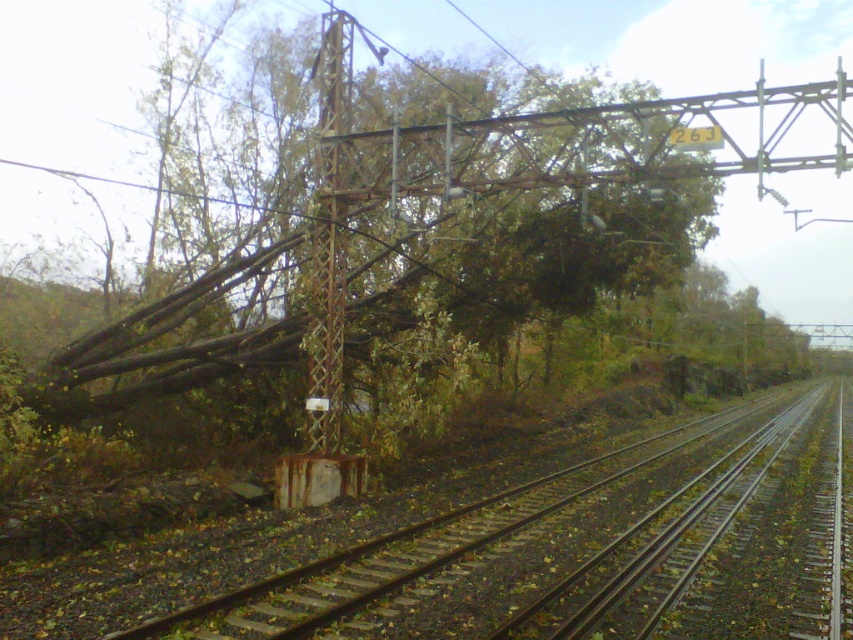
Can you confirm if rusty metal train track at left is positioned below rusty metal pole at center?

Yes, rusty metal train track at left is below rusty metal pole at center.

Between point (647, 496) and point (329, 369), which one is positioned behind?

The point (647, 496) is more distant.

Is point (821, 532) more distant than point (314, 384)?

No, it is in front of (314, 384).

The height and width of the screenshot is (640, 853). In order to click on rusty metal train track at left in this screenshot , I will do `click(593, 548)`.

What do you see at coordinates (503, 209) in the screenshot? This screenshot has width=853, height=640. I see `brown wood tree at center` at bounding box center [503, 209].

Is the position of brown wood tree at center less distant than that of rusty metal train track at left?

No, brown wood tree at center is behind rusty metal train track at left.

Is point (447, 209) positioned before point (579, 564)?

No, it is behind (579, 564).

Where is `brown wood tree at center`? brown wood tree at center is located at coordinates (503, 209).

Does brown wood tree at center appear under rusty metal pole at center?

No.

Can you confirm if brown wood tree at center is smaller than rusty metal pole at center?

No.

Where is `brown wood tree at center`? brown wood tree at center is located at coordinates (503, 209).